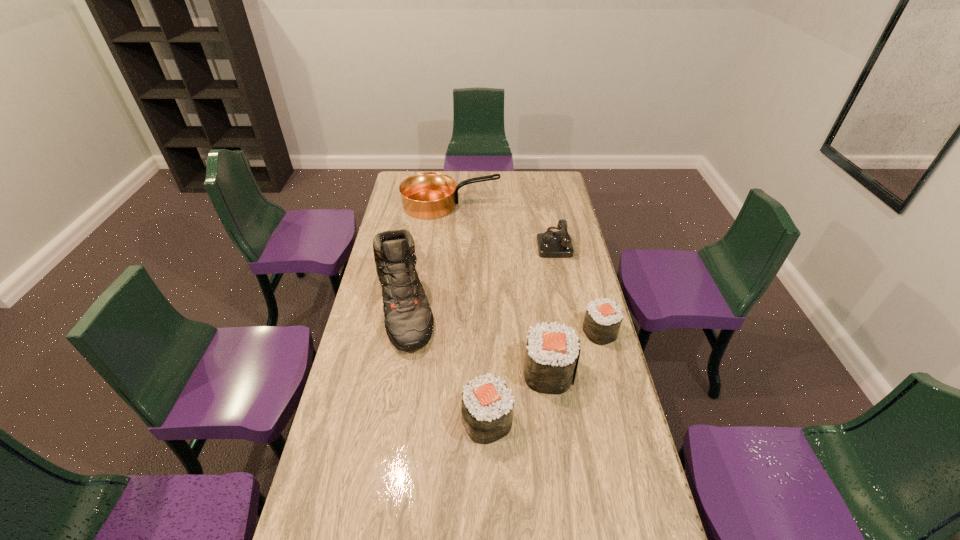
Identify the location of vacant space positioned on the front of the shortest sushi. (628, 436).

Find the location of a particular element. free location located on the dial of the fifth nearest object is located at coordinates (510, 243).

This screenshot has height=540, width=960. Identify the location of vacant area located 0.330m on the dial of the fifth nearest object. (464, 243).

This screenshot has height=540, width=960. Identify the location of free space located on the dial of the fifth nearest object. (476, 243).

At what (x,y) coordinates should I click in order to perform the action: click on free point located 0.350m on the handle side of the frying pan. Please return your answer as a coordinate pair (x, y). Looking at the image, I should click on (569, 205).

Where is `vacant space located on the right of the tallest object`? vacant space located on the right of the tallest object is located at coordinates (509, 307).

Find the location of a particular element. The width and height of the screenshot is (960, 540). object that is at the far edge is located at coordinates (429, 195).

What are the coordinates of `frying pan that is at the left edge` in the screenshot? It's located at (429, 195).

Where is `ski boot that is positioned at the left edge`? The height and width of the screenshot is (540, 960). ski boot that is positioned at the left edge is located at coordinates (409, 321).

Locate an element on the screen. The height and width of the screenshot is (540, 960). telephone that is at the right edge is located at coordinates (552, 244).